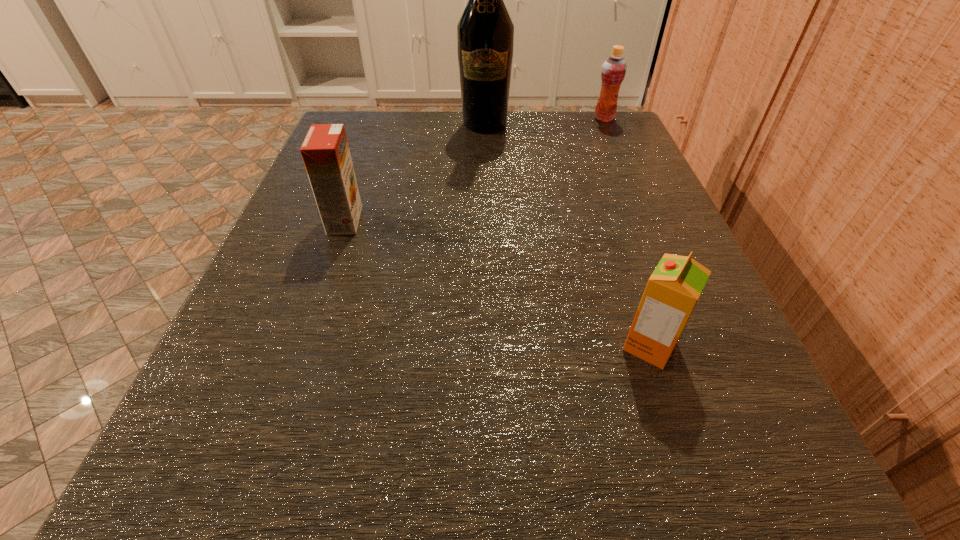
In the image, there is a desktop. Identify the location of vacant space at the far left corner. This screenshot has height=540, width=960. (405, 111).

In order to click on vacant space at the far right corner of the desktop in this screenshot , I will do `click(581, 114)`.

In order to click on empty space between the farthest orange juice and the tallest object in this screenshot , I will do [x=544, y=121].

Where is `free space between the third object from right to left and the second farthest orange juice`? The width and height of the screenshot is (960, 540). free space between the third object from right to left and the second farthest orange juice is located at coordinates (415, 172).

Where is `empty location between the third object from right to left and the rightmost object`? empty location between the third object from right to left and the rightmost object is located at coordinates (544, 121).

The image size is (960, 540). I want to click on unoccupied position between the second object from left to right and the rightmost object, so click(x=544, y=121).

Where is `free space between the third object from right to left and the farthest orange juice`? free space between the third object from right to left and the farthest orange juice is located at coordinates (544, 121).

Identify the location of vacant area that lies between the second orange juice from right to left and the rightmost object. (627, 232).

Find the location of `free space that is in between the farthest orange juice and the nearest orange juice`. free space that is in between the farthest orange juice and the nearest orange juice is located at coordinates (627, 232).

Image resolution: width=960 pixels, height=540 pixels. In order to click on free space between the nearest orange juice and the leftmost orange juice in this screenshot , I will do `click(497, 283)`.